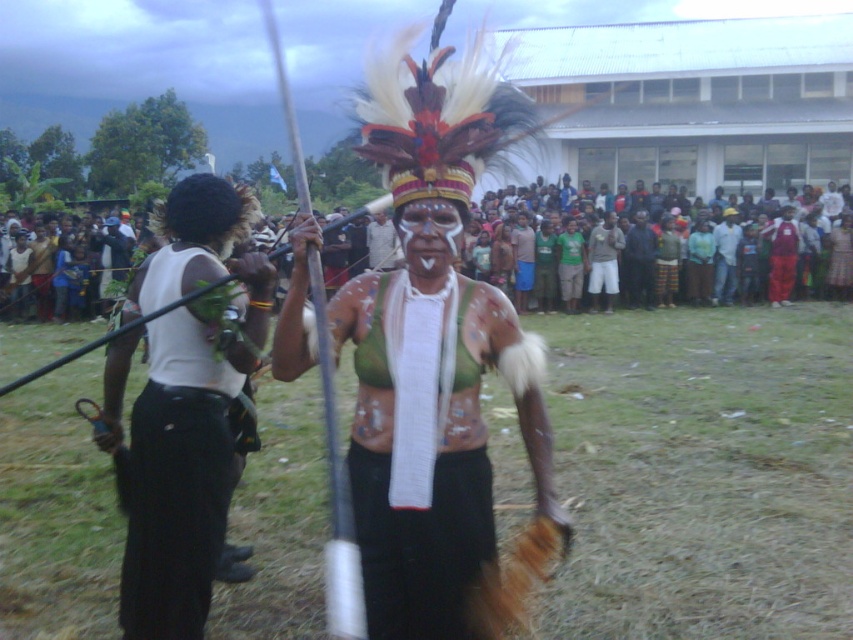
Does matte green feathered vest at center have a greater width compared to white matte vest at left?

Yes, matte green feathered vest at center is wider than white matte vest at left.

At what (x,y) coordinates should I click in order to perform the action: click on matte green feathered vest at center. Please return your answer as a coordinate pair (x, y). This screenshot has width=853, height=640. Looking at the image, I should click on (440, 454).

Where is `matte green feathered vest at center`? Image resolution: width=853 pixels, height=640 pixels. matte green feathered vest at center is located at coordinates (440, 454).

Does matte green feathered vest at center have a smaller size compared to white matte face at center?

Actually, matte green feathered vest at center might be larger than white matte face at center.

Is the position of matte green feathered vest at center more distant than that of white matte face at center?

No, it is not.

Does point (402, 637) come closer to viewer compared to point (408, 216)?

Yes, it is.

You are a GUI agent. You are given a task and a screenshot of the screen. Output one action in this format:
    pyautogui.click(x=<x>, y=<y>)
    Task: Click on the matte green feathered vest at center
    This screenshot has height=640, width=853.
    Given the screenshot: What is the action you would take?
    pyautogui.click(x=440, y=454)

Does white matte vest at left have a smaller size compared to red fabric pants at right?

Result: Indeed, white matte vest at left has a smaller size compared to red fabric pants at right.

Between point (257, 442) and point (786, 237), which one is positioned in front?

Positioned in front is point (257, 442).

At what (x,y) coordinates should I click in order to perform the action: click on white matte vest at left. Please return your answer as a coordinate pair (x, y). Image resolution: width=853 pixels, height=640 pixels. Looking at the image, I should click on (184, 513).